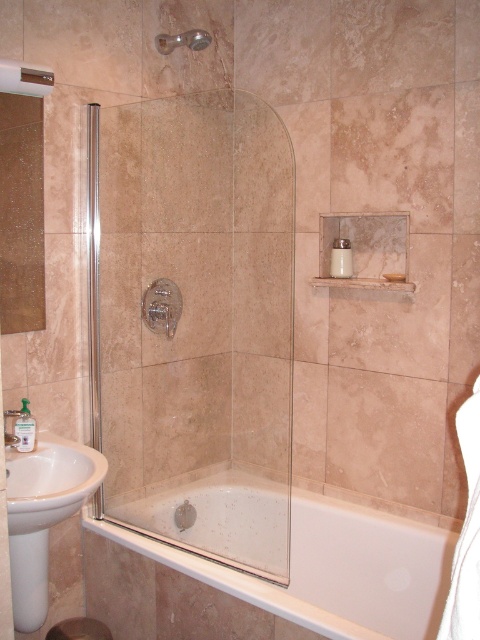
You are a plumber inspecting the bathroom and need to replace either the matte silver showerhead at upper center or the brushed metal faucet at lower left. Which fixture might require a wider replacement part?

The matte silver showerhead at upper center might require a wider replacement part since it is described as possibly being wider than the brushed metal faucet at lower left.

You are standing in the bathroom and want to enter the shower area. The clear glass shower door at center is located at point (197, 324). Can you walk directly to the clear glass shower door at center from your current position without moving around any obstacles?

The clear glass shower door at center is located at point (197, 324). Since there are no obstacles mentioned between your current position and the door, you can walk directly to the clear glass shower door at center.